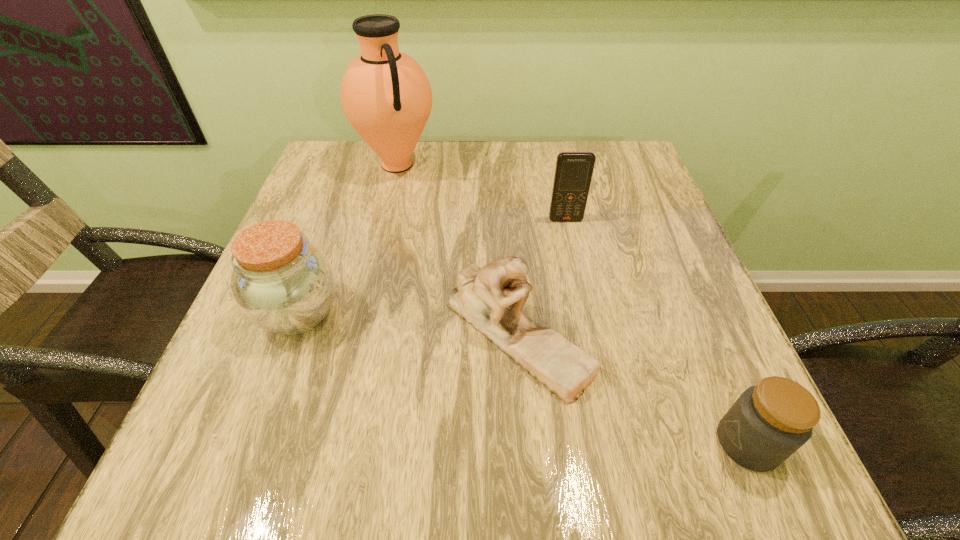
Identify the location of vacant area located on the screen of the second farthest object. The height and width of the screenshot is (540, 960). (576, 270).

The height and width of the screenshot is (540, 960). What are the coordinates of `free space located on the surface of the shortest object near the warning symbol` in the screenshot? It's located at (511, 443).

Identify the location of free location located on the surface of the shortest object near the warning symbol. (524, 443).

Find the location of a particular element. blank area located on the surface of the shortest object near the warning symbol is located at coordinates (662, 443).

Where is `object that is at the far edge`? This screenshot has height=540, width=960. object that is at the far edge is located at coordinates point(385,94).

Image resolution: width=960 pixels, height=540 pixels. What are the coordinates of `object located at the near edge` in the screenshot? It's located at [770, 421].

This screenshot has width=960, height=540. What are the coordinates of `pitcher at the left edge` in the screenshot? It's located at (385, 94).

Where is `jar that is at the left edge`? The width and height of the screenshot is (960, 540). jar that is at the left edge is located at coordinates (282, 283).

The width and height of the screenshot is (960, 540). In order to click on object that is at the right edge in this screenshot , I will do `click(770, 421)`.

Where is `object that is at the far left corner`? object that is at the far left corner is located at coordinates (385, 94).